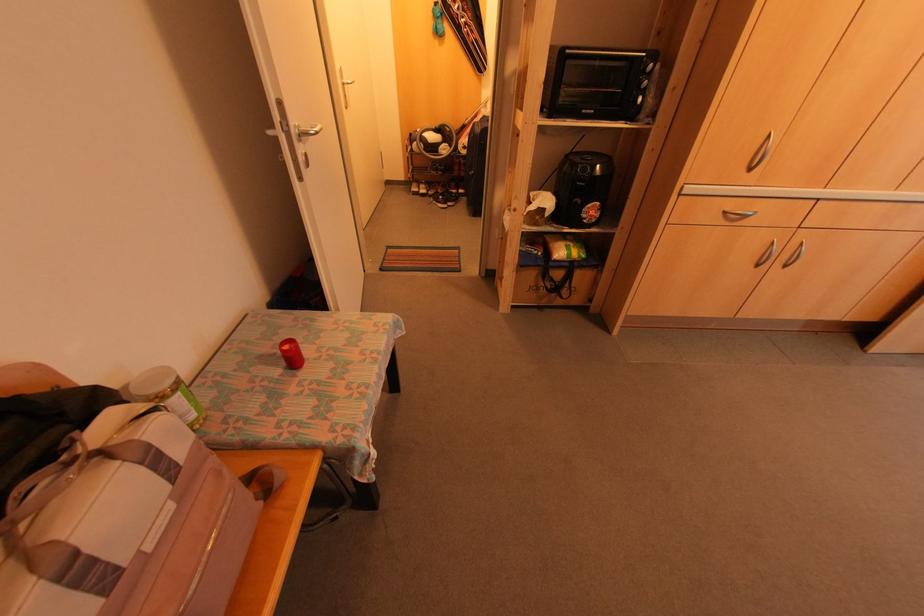
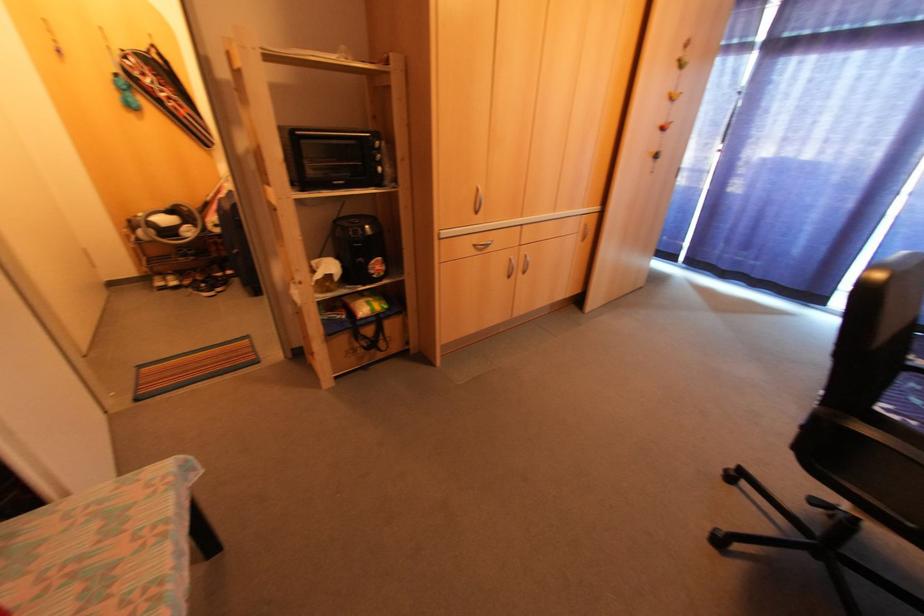
The point at (555,276) is marked in the first image. Where is the corresponding point in the second image?

(367, 331)